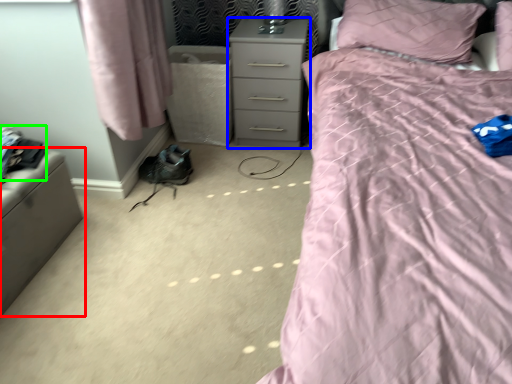
Question: Based on their relative distances, which object is farther from furniture (highlighted by a red box)? Choose from nightstand (highlighted by a blue box) and clothing (highlighted by a green box).

Choices:
 (A) nightstand
 (B) clothing

Answer: (A)